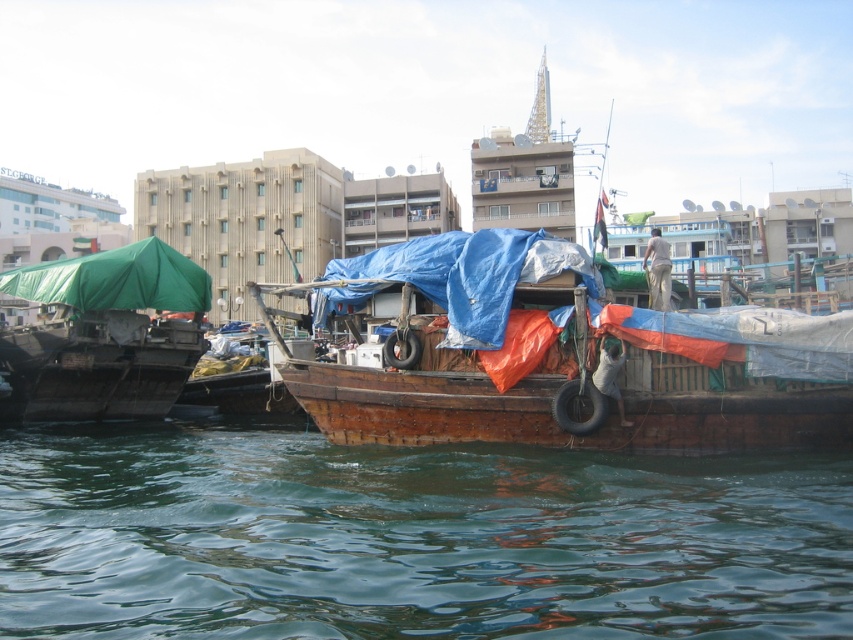
You are a tourist standing on the dock and want to take a photo of the wooden boat at center and the green tarpaulin canopy at left. Which object should you focus on first if you want to capture both in one shot without moving the camera?

You should focus on the wooden boat at center first because it is much taller than the green tarpaulin canopy at left, so adjusting the focus to the taller object ensures both are in frame.